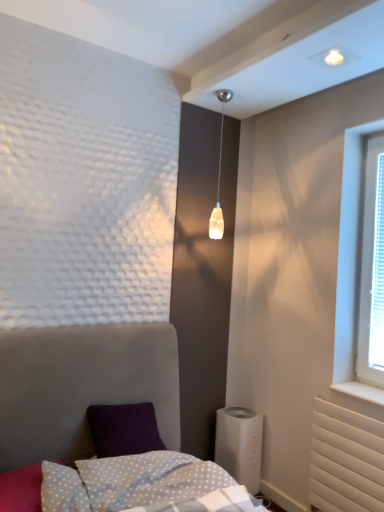
Question: From a real-world perspective, relative to white plastic humidifier at lower right, is white dotted fabric pillow at lower left vertically above or below?

Choices:
 (A) below
 (B) above

Answer: (B)

Question: Which is correct: white dotted fabric pillow at lower left is inside white plastic humidifier at lower right, or outside of it?

Choices:
 (A) outside
 (B) inside

Answer: (A)

Question: Estimate the real-world distances between objects in this image. Which object is closer to the white dotted fabric at lower center?

Choices:
 (A) velvet grey bed at lower left
 (B) white plastic humidifier at lower right
 (C) white dotted fabric pillow at lower left
 (D) white plastic blinds at right
 (E) translucent glass pendant light at upper center

Answer: (C)

Question: Which object is positioned closest to the velvet grey bed at lower left?

Choices:
 (A) white dotted fabric pillow at lower left
 (B) white plastic humidifier at lower right
 (C) translucent glass pendant light at upper center
 (D) white plastic blinds at right
 (E) white dotted fabric at lower center

Answer: (E)